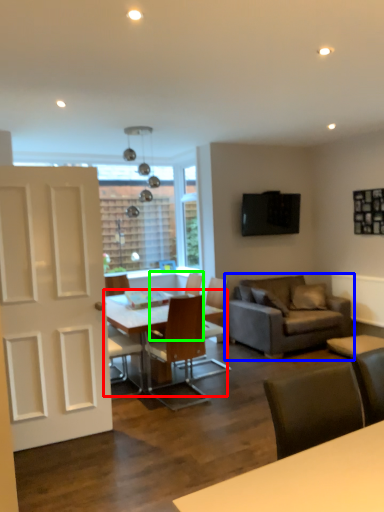
Question: Which is nearer to the table (highlighted by a red box)? studio couch (highlighted by a blue box) or chair (highlighted by a green box).

Choices:
 (A) studio couch
 (B) chair

Answer: (B)